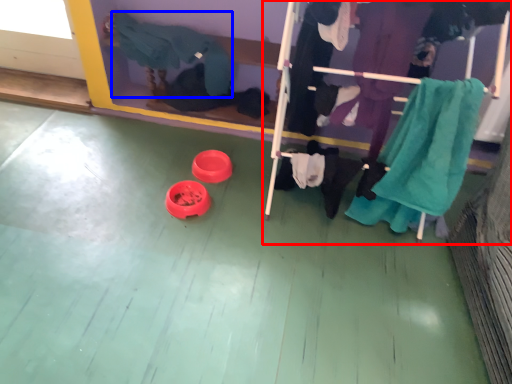
Question: Which point is closer to the camera, furniture (highlighted by a red box) or clothing (highlighted by a blue box)?

Choices:
 (A) furniture
 (B) clothing

Answer: (A)